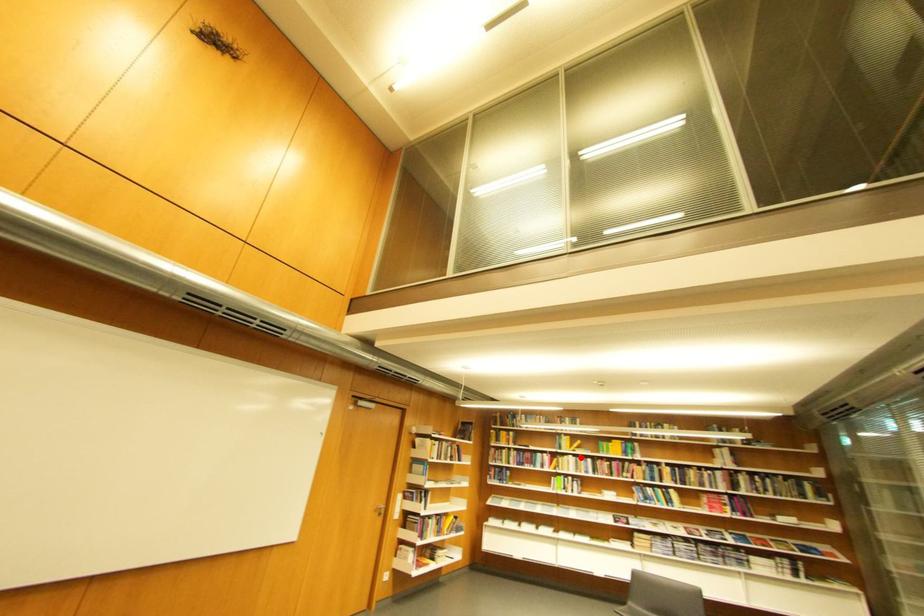
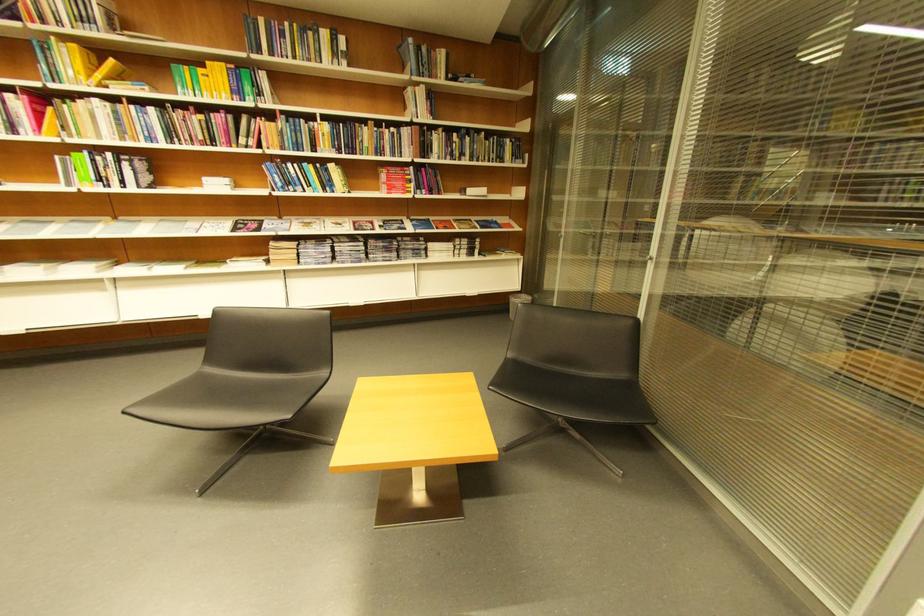
Where in the second image is the point corresponding to the highlighted location from the first image?

(106, 102)